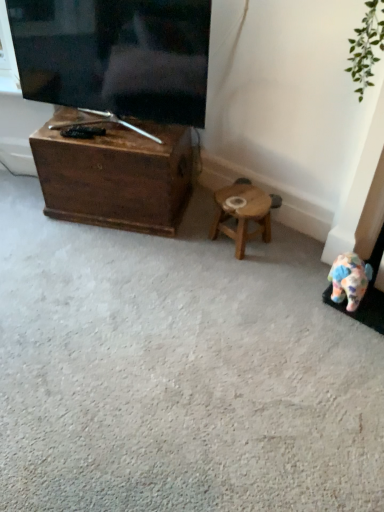
Where is `vacant point above wooden chest at left (from a real-world perspective)`? vacant point above wooden chest at left (from a real-world perspective) is located at coordinates (106, 137).